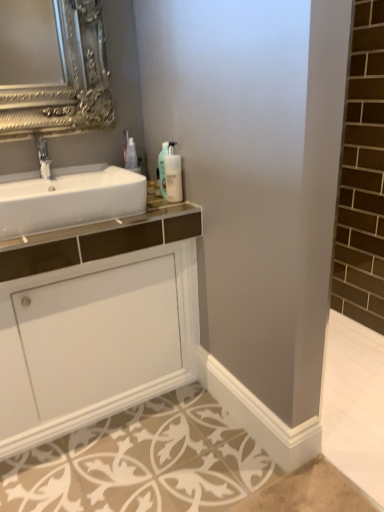
What are the coordinates of `vacant area that is in front of translucent plastic soap dispenser at upper center, the second soap dispenser from the right` in the screenshot? It's located at (161, 211).